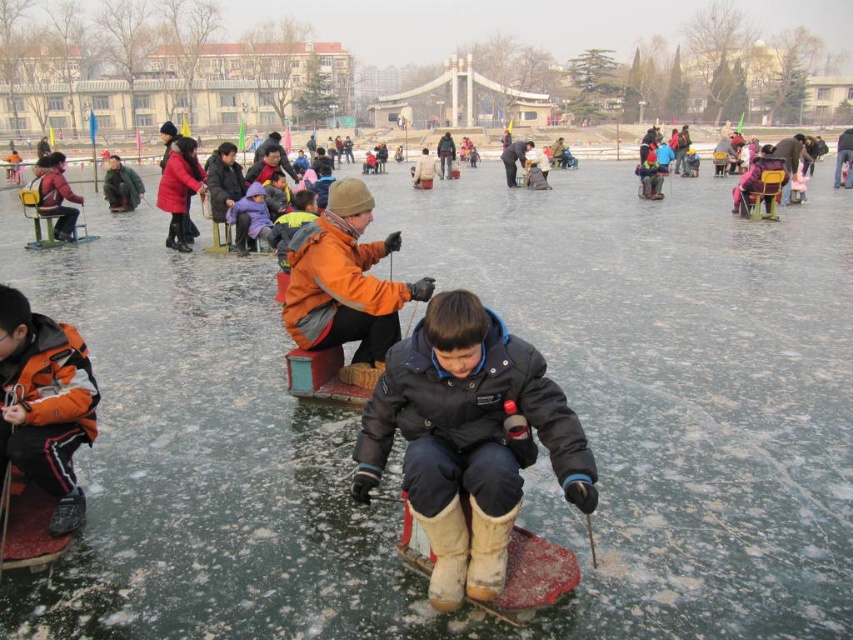
Between point (392, 396) and point (105, 192), which one is positioned in front?

Point (392, 396)

Who is positioned more to the right, dark blue matte jacket at center or green fuzzy jacket at left?

dark blue matte jacket at center is more to the right.

Where is `dark blue matte jacket at center`? The width and height of the screenshot is (853, 640). dark blue matte jacket at center is located at coordinates [468, 440].

How much distance is there between dark gray woolen hat at upper center and orange woolen sweater at center?

dark gray woolen hat at upper center and orange woolen sweater at center are 6.90 meters apart.

Does point (525, 150) come farther from viewer compared to point (421, 182)?

Yes, point (525, 150) is behind point (421, 182).

Image resolution: width=853 pixels, height=640 pixels. In order to click on dark gray woolen hat at upper center in this screenshot , I will do `click(514, 157)`.

Does matte red coat at upper left have a smaller size compared to dark gray woolen hat at upper center?

Yes, matte red coat at upper left is smaller than dark gray woolen hat at upper center.

Is matte red coat at upper left taller than dark gray woolen hat at upper center?

No.

The width and height of the screenshot is (853, 640). I want to click on matte red coat at upper left, so click(x=178, y=189).